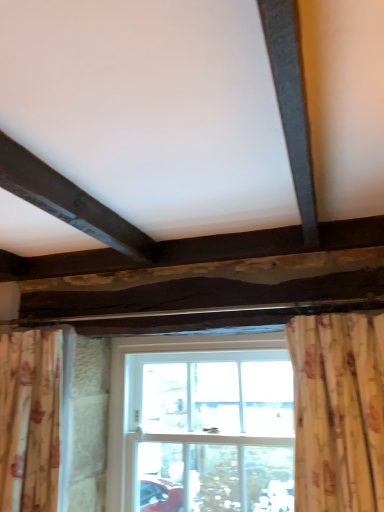
The image size is (384, 512). What do you see at coordinates (30, 420) in the screenshot?
I see `floral fabric curtain at lower left` at bounding box center [30, 420].

Where is `floral fabric curtain at lower left`? floral fabric curtain at lower left is located at coordinates (30, 420).

Find the location of a particular element. Image resolution: width=384 pixels, height=512 pixels. white wooden window at center is located at coordinates (201, 424).

This screenshot has height=512, width=384. What do you see at coordinates (201, 424) in the screenshot? I see `white wooden window at center` at bounding box center [201, 424].

Locate an element on the screen. The width and height of the screenshot is (384, 512). floral fabric curtain at lower left is located at coordinates (30, 420).

Considering the relative positions of white wooden window at center and floral fabric curtain at lower left in the image provided, is white wooden window at center to the left of floral fabric curtain at lower left from the viewer's perspective?

In fact, white wooden window at center is to the right of floral fabric curtain at lower left.

Between white wooden window at center and floral fabric curtain at lower left, which one is positioned in front?

floral fabric curtain at lower left.

Is point (160, 482) positioned before point (13, 497)?

No, it is not.

From the image's perspective, which is above, white wooden window at center or floral fabric curtain at lower left?

floral fabric curtain at lower left.

From a real-world perspective, between white wooden window at center and floral fabric curtain at lower left, who is vertically lower?

white wooden window at center, from a real-world perspective.

Which of these two, white wooden window at center or floral fabric curtain at lower left, is wider?

Wider between the two is floral fabric curtain at lower left.

Who is shorter, white wooden window at center or floral fabric curtain at lower left?

Standing shorter between the two is floral fabric curtain at lower left.

Considering the relative sizes of white wooden window at center and floral fabric curtain at lower left in the image provided, is white wooden window at center bigger than floral fabric curtain at lower left?

Yes.

Would you say white wooden window at center is outside floral fabric curtain at lower left?

Yes.

Is white wooden window at center next to floral fabric curtain at lower left and touching it?

No, white wooden window at center is not in contact with floral fabric curtain at lower left.

Is white wooden window at center oriented towards floral fabric curtain at lower left?

Yes, white wooden window at center faces towards floral fabric curtain at lower left.

Can you tell me how much white wooden window at center and floral fabric curtain at lower left differ in facing direction?

0.0331 degrees.

Locate an element on the screen. Image resolution: width=384 pixels, height=512 pixels. window on the right of floral fabric curtain at lower left is located at coordinates (201, 424).

Is floral fabric curtain at lower left at the left side of white wooden window at center?

Indeed, floral fabric curtain at lower left is positioned on the left side of white wooden window at center.

Is floral fabric curtain at lower left further to camera compared to white wooden window at center?

No, it is in front of white wooden window at center.

Which is less distant, (3, 388) or (132, 461)?

The point (3, 388) is more forward.

From the image's perspective, who appears lower, floral fabric curtain at lower left or white wooden window at center?

white wooden window at center, from the image's perspective.

From a real-world perspective, between floral fabric curtain at lower left and white wooden window at center, who is vertically lower?

white wooden window at center.

Considering the sizes of floral fabric curtain at lower left and white wooden window at center in the image, is floral fabric curtain at lower left wider or thinner than white wooden window at center?

In the image, floral fabric curtain at lower left appears to be wider than white wooden window at center.

Looking at this image, does floral fabric curtain at lower left have a lesser height compared to white wooden window at center?

Yes, floral fabric curtain at lower left is shorter than white wooden window at center.

Between floral fabric curtain at lower left and white wooden window at center, which one has larger size?

Bigger between the two is white wooden window at center.

Which is correct: floral fabric curtain at lower left is inside white wooden window at center, or outside of it?

floral fabric curtain at lower left is not enclosed by white wooden window at center.

Would you say floral fabric curtain at lower left is a long distance from white wooden window at center?

floral fabric curtain at lower left is actually quite close to white wooden window at center.

Is floral fabric curtain at lower left positioned with its back to white wooden window at center?

No, floral fabric curtain at lower left is not facing the opposite direction of white wooden window at center.

How different are the orientations of floral fabric curtain at lower left and white wooden window at center in degrees?

0.0331 degrees separate the facing orientations of floral fabric curtain at lower left and white wooden window at center.

Image resolution: width=384 pixels, height=512 pixels. In order to click on window that is below the floral fabric curtain at lower left (from the image's perspective) in this screenshot , I will do 201,424.

At what (x,y) coordinates should I click in order to perform the action: click on curtain lying on the left of white wooden window at center. Please return your answer as a coordinate pair (x, y). This screenshot has width=384, height=512. Looking at the image, I should click on (30, 420).

This screenshot has height=512, width=384. Identify the location of window below the floral fabric curtain at lower left (from a real-world perspective). (201, 424).